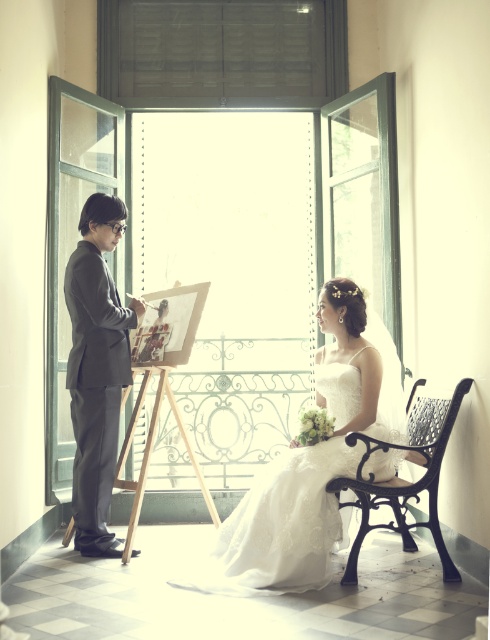
Question: Is gray suit at left bigger than black wrought iron bench at lower right?

Choices:
 (A) yes
 (B) no

Answer: (B)

Question: Which object is the farthest from the white lace dress at center?

Choices:
 (A) gray suit at left
 (B) black wrought iron bench at lower right

Answer: (A)

Question: Where is white lace dress at center located in relation to black wrought iron bench at lower right in the image?

Choices:
 (A) left
 (B) right

Answer: (A)

Question: Based on their relative distances, which object is nearer to the gray suit at left?

Choices:
 (A) black wrought iron bench at lower right
 (B) white lace dress at center

Answer: (B)

Question: Which object is positioned closest to the gray suit at left?

Choices:
 (A) white lace dress at center
 (B) black wrought iron bench at lower right

Answer: (A)

Question: Is white lace dress at center positioned at the back of black wrought iron bench at lower right?

Choices:
 (A) no
 (B) yes

Answer: (A)